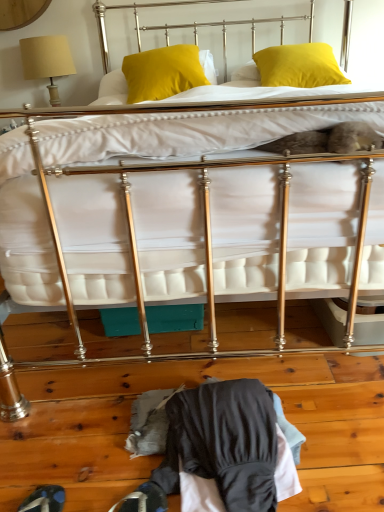
The image size is (384, 512). Describe the element at coordinates (162, 72) in the screenshot. I see `yellow velvet pillow at upper center, the 1th pillow in the left-to-right sequence` at that location.

Image resolution: width=384 pixels, height=512 pixels. Describe the element at coordinates (47, 61) in the screenshot. I see `beige fabric lampshade at upper left` at that location.

I want to click on yellow velvet pillow at upper center, placed as the 2th pillow when sorted from right to left, so click(x=162, y=72).

Is dark gray fabric at lower center oriented towards yellow matte pillow at upper right, placed as the 1th pillow when sorted from right to left?

No.

From the image's perspective, is dark gray fabric at lower center on yellow matte pillow at upper right, the second pillow viewed from the left?

No, from the image's perspective, dark gray fabric at lower center is not on top of yellow matte pillow at upper right, the second pillow viewed from the left.

Considering the relative sizes of dark gray fabric at lower center and yellow matte pillow at upper right, the second pillow viewed from the left, in the image provided, is dark gray fabric at lower center taller than yellow matte pillow at upper right, the second pillow viewed from the left,?

No, dark gray fabric at lower center is not taller than yellow matte pillow at upper right, the second pillow viewed from the left.

Is dark gray fabric at lower center not within yellow matte pillow at upper right, placed as the 1th pillow when sorted from right to left?

dark gray fabric at lower center is positioned outside yellow matte pillow at upper right, placed as the 1th pillow when sorted from right to left.

Does yellow velvet pillow at upper center, the 1th pillow in the left-to-right sequence, have a lesser width compared to yellow matte pillow at upper right, the second pillow viewed from the left?

Indeed, yellow velvet pillow at upper center, the 1th pillow in the left-to-right sequence, has a lesser width compared to yellow matte pillow at upper right, the second pillow viewed from the left.

Is point (127, 81) positioned behind point (297, 81)?

Yes, point (127, 81) is farther from viewer.

Is dark gray fabric at lower center facing away from yellow velvet pillow at upper center, placed as the 2th pillow when sorted from right to left?

dark gray fabric at lower center does not have its back to yellow velvet pillow at upper center, placed as the 2th pillow when sorted from right to left.

Based on the photo, what's the angular difference between dark gray fabric at lower center and yellow velvet pillow at upper center, placed as the 2th pillow when sorted from right to left,'s facing directions?

The angle between the facing direction of dark gray fabric at lower center and the facing direction of yellow velvet pillow at upper center, placed as the 2th pillow when sorted from right to left, is 10.6 degrees.

Is dark gray fabric at lower center in contact with yellow velvet pillow at upper center, the 1th pillow in the left-to-right sequence?

dark gray fabric at lower center and yellow velvet pillow at upper center, the 1th pillow in the left-to-right sequence, are clearly separated.

Does dark gray fabric at lower center lie in front of yellow velvet pillow at upper center, the 1th pillow in the left-to-right sequence?

Yes, dark gray fabric at lower center is in front of yellow velvet pillow at upper center, the 1th pillow in the left-to-right sequence.

Considering the relative sizes of yellow velvet pillow at upper center, the 1th pillow in the left-to-right sequence, and beige fabric lampshade at upper left in the image provided, is yellow velvet pillow at upper center, the 1th pillow in the left-to-right sequence, smaller than beige fabric lampshade at upper left?

Incorrect, yellow velvet pillow at upper center, the 1th pillow in the left-to-right sequence, is not smaller in size than beige fabric lampshade at upper left.

How different are the orientations of yellow velvet pillow at upper center, placed as the 2th pillow when sorted from right to left, and beige fabric lampshade at upper left in degrees?

The angular difference between yellow velvet pillow at upper center, placed as the 2th pillow when sorted from right to left, and beige fabric lampshade at upper left is 7.03 degrees.

Considering the positions of objects yellow velvet pillow at upper center, the 1th pillow in the left-to-right sequence, and beige fabric lampshade at upper left in the image provided, who is in front, yellow velvet pillow at upper center, the 1th pillow in the left-to-right sequence, or beige fabric lampshade at upper left?

yellow velvet pillow at upper center, the 1th pillow in the left-to-right sequence, is in front.

Can you confirm if yellow velvet pillow at upper center, the 1th pillow in the left-to-right sequence, is thinner than beige fabric lampshade at upper left?

No, yellow velvet pillow at upper center, the 1th pillow in the left-to-right sequence, is not thinner than beige fabric lampshade at upper left.

Is dark blue leather shoe at lower left next to yellow matte pillow at upper right, placed as the 1th pillow when sorted from right to left, and touching it?

dark blue leather shoe at lower left is not next to yellow matte pillow at upper right, placed as the 1th pillow when sorted from right to left, and they're not touching.

Consider the image. Considering the relative positions of dark blue leather shoe at lower left and yellow matte pillow at upper right, the second pillow viewed from the left, in the image provided, is dark blue leather shoe at lower left in front of yellow matte pillow at upper right, the second pillow viewed from the left,?

Yes, dark blue leather shoe at lower left is closer to the camera.

Is dark blue leather shoe at lower left bigger or smaller than yellow matte pillow at upper right, the second pillow viewed from the left?

dark blue leather shoe at lower left is smaller than yellow matte pillow at upper right, the second pillow viewed from the left.

Is point (31, 506) in front of point (277, 48)?

Yes.

How far apart are dark blue leather shoe at lower left and beige fabric lampshade at upper left?

The distance of dark blue leather shoe at lower left from beige fabric lampshade at upper left is 7.73 feet.

From the image's perspective, which one is positioned higher, dark blue leather shoe at lower left or beige fabric lampshade at upper left?

beige fabric lampshade at upper left is shown above in the image.

What's the angular difference between dark blue leather shoe at lower left and beige fabric lampshade at upper left's facing directions?

84.6 degrees separate the facing orientations of dark blue leather shoe at lower left and beige fabric lampshade at upper left.

From a real-world perspective, which object stands above the other?

beige fabric lampshade at upper left is physically above.

In terms of size, does beige fabric lampshade at upper left appear bigger or smaller than dark blue leather shoe at lower left?

beige fabric lampshade at upper left is bigger than dark blue leather shoe at lower left.

Is beige fabric lampshade at upper left outside of dark blue leather shoe at lower left?

Indeed, beige fabric lampshade at upper left is completely outside dark blue leather shoe at lower left.

In the scene shown: Between beige fabric lampshade at upper left and dark blue leather shoe at lower left, which one has larger width?

Wider between the two is beige fabric lampshade at upper left.

From the image's perspective, is beige fabric lampshade at upper left positioned above or below dark blue leather shoe at lower left?

beige fabric lampshade at upper left is above dark blue leather shoe at lower left.

The width and height of the screenshot is (384, 512). I want to click on clothing in front of the yellow matte pillow at upper right, placed as the 1th pillow when sorted from right to left, so click(228, 447).

Find the location of `pillow above the yellow matte pillow at upper right, the second pillow viewed from the left (from a real-world perspective)`. pillow above the yellow matte pillow at upper right, the second pillow viewed from the left (from a real-world perspective) is located at coordinates (162, 72).

Based on their spatial positions, is yellow velvet pillow at upper center, the 1th pillow in the left-to-right sequence, or dark blue leather shoe at lower left closer to dark gray fabric at lower center?

Among the two, dark blue leather shoe at lower left is located nearer to dark gray fabric at lower center.

Looking at the image, which one is located closer to beige fabric lampshade at upper left, yellow matte pillow at upper right, the second pillow viewed from the left, or dark gray fabric at lower center?

Based on the image, yellow matte pillow at upper right, the second pillow viewed from the left, appears to be nearer to beige fabric lampshade at upper left.

Considering their positions, is dark gray fabric at lower center positioned closer to yellow matte pillow at upper right, the second pillow viewed from the left, than beige fabric lampshade at upper left?

beige fabric lampshade at upper left is closer to yellow matte pillow at upper right, the second pillow viewed from the left.

From the image, which object appears to be nearer to beige fabric lampshade at upper left, yellow velvet pillow at upper center, the 1th pillow in the left-to-right sequence, or yellow matte pillow at upper right, placed as the 1th pillow when sorted from right to left?

Among the two, yellow velvet pillow at upper center, the 1th pillow in the left-to-right sequence, is located nearer to beige fabric lampshade at upper left.

From the image, which object appears to be farther from dark gray fabric at lower center, beige fabric lampshade at upper left or yellow matte pillow at upper right, the second pillow viewed from the left?

Among the two, beige fabric lampshade at upper left is located further to dark gray fabric at lower center.

When comparing their distances from beige fabric lampshade at upper left, does dark gray fabric at lower center or yellow velvet pillow at upper center, placed as the 2th pillow when sorted from right to left, seem further?

The object further to beige fabric lampshade at upper left is dark gray fabric at lower center.

Considering their positions, is beige fabric lampshade at upper left positioned further to dark blue leather shoe at lower left than yellow matte pillow at upper right, placed as the 1th pillow when sorted from right to left?

The object further to dark blue leather shoe at lower left is beige fabric lampshade at upper left.

From the image, which object appears to be nearer to dark gray fabric at lower center, dark blue leather shoe at lower left or yellow matte pillow at upper right, placed as the 1th pillow when sorted from right to left?

dark blue leather shoe at lower left is closer to dark gray fabric at lower center.

The image size is (384, 512). Identify the location of pillow between yellow matte pillow at upper right, placed as the 1th pillow when sorted from right to left, and dark gray fabric at lower center vertically. (162, 72).

Where is `pillow located between beige fabric lampshade at upper left and yellow matte pillow at upper right, the second pillow viewed from the left, in the left-right direction`? The image size is (384, 512). pillow located between beige fabric lampshade at upper left and yellow matte pillow at upper right, the second pillow viewed from the left, in the left-right direction is located at coordinates (162, 72).

What are the coordinates of `clothing between yellow matte pillow at upper right, placed as the 1th pillow when sorted from right to left, and dark blue leather shoe at lower left vertically` in the screenshot? It's located at (228, 447).

Locate an element on the screen. The height and width of the screenshot is (512, 384). clothing between beige fabric lampshade at upper left and dark blue leather shoe at lower left from top to bottom is located at coordinates (228, 447).